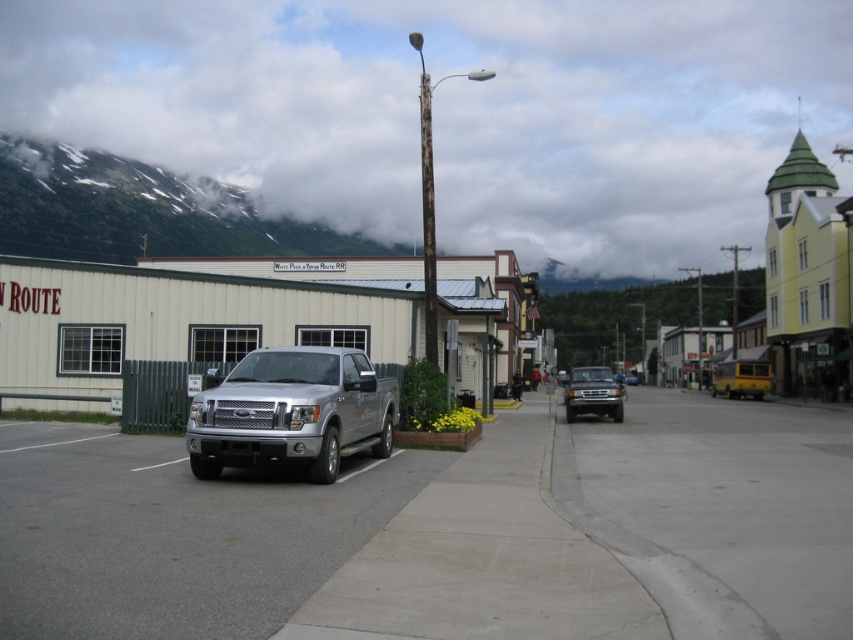
You are standing at the beginning of the road in the town scene. You see two points marked on the image, one at point (383, 452) and another at point (717, 387). Which point is closer to you?

Point (383, 452) is closer to the viewer than point (717, 387).

You are a delivery person trying to park your vehicle on the gray asphalt pavement at center. However, there is a height restriction sign indicating that the maximum allowed height is the height of the gray concrete pavement at center. Can your vehicle, which is 2 meters tall, safely park there?

The gray asphalt pavement at center is not as tall as the gray concrete pavement at center, so the maximum allowed height is higher than 2 meters. Therefore, your vehicle can safely park there.